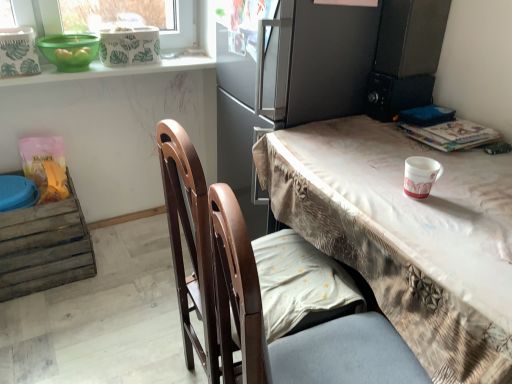
I want to click on free location to the left of hardcover book at upper right, so click(x=374, y=137).